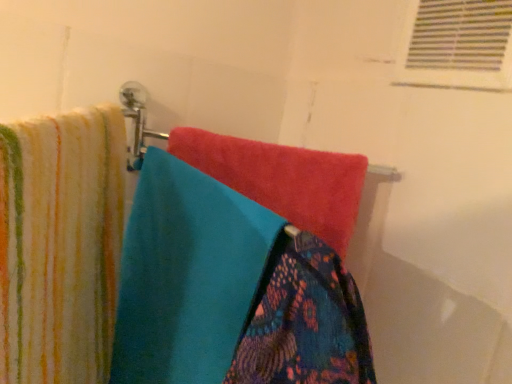
Question: In which direction should I rotate to look at patterned fabric towel at center, which is the third towel from left to right?

Choices:
 (A) right
 (B) left

Answer: (A)

Question: From the image's perspective, is patterned fabric towel at center, which is the first towel in right-to-left order, below white plastic vent at upper right?

Choices:
 (A) no
 (B) yes

Answer: (B)

Question: Is patterned fabric towel at center, which is the third towel from left to right, facing away from white plastic vent at upper right?

Choices:
 (A) no
 (B) yes

Answer: (A)

Question: Does patterned fabric towel at center, which is the first towel in right-to-left order, have a greater height compared to white plastic vent at upper right?

Choices:
 (A) yes
 (B) no

Answer: (B)

Question: Considering the relative positions of patterned fabric towel at center, which is the third towel from left to right, and white plastic vent at upper right in the image provided, is patterned fabric towel at center, which is the third towel from left to right, behind white plastic vent at upper right?

Choices:
 (A) no
 (B) yes

Answer: (A)

Question: Is patterned fabric towel at center, which is the first towel in right-to-left order, thinner than white plastic vent at upper right?

Choices:
 (A) yes
 (B) no

Answer: (B)

Question: Does patterned fabric towel at center, which is the third towel from left to right, have a larger size compared to white plastic vent at upper right?

Choices:
 (A) yes
 (B) no

Answer: (A)

Question: Is turquoise soft towel at center, the 2th towel from the left, closer to camera compared to patterned fabric towel at center, which is the first towel in right-to-left order?

Choices:
 (A) yes
 (B) no

Answer: (B)

Question: Is turquoise soft towel at center, positioned as the 2th towel in right-to-left order, aimed at patterned fabric towel at center, which is the first towel in right-to-left order?

Choices:
 (A) yes
 (B) no

Answer: (A)

Question: Does turquoise soft towel at center, positioned as the 2th towel in right-to-left order, come behind patterned fabric towel at center, which is the third towel from left to right?

Choices:
 (A) no
 (B) yes

Answer: (B)

Question: Considering the relative sizes of turquoise soft towel at center, positioned as the 2th towel in right-to-left order, and patterned fabric towel at center, which is the first towel in right-to-left order, in the image provided, is turquoise soft towel at center, positioned as the 2th towel in right-to-left order, thinner than patterned fabric towel at center, which is the first towel in right-to-left order,?

Choices:
 (A) yes
 (B) no

Answer: (B)

Question: Is turquoise soft towel at center, the 2th towel from the left, wider than patterned fabric towel at center, which is the third towel from left to right?

Choices:
 (A) yes
 (B) no

Answer: (A)

Question: Does turquoise soft towel at center, positioned as the 2th towel in right-to-left order, have a smaller size compared to patterned fabric towel at center, which is the third towel from left to right?

Choices:
 (A) yes
 (B) no

Answer: (B)

Question: From a real-world perspective, is patterned fabric towel at center, which is the third towel from left to right, under striped cotton towel at left, which is the 1th towel from left to right?

Choices:
 (A) yes
 (B) no

Answer: (B)